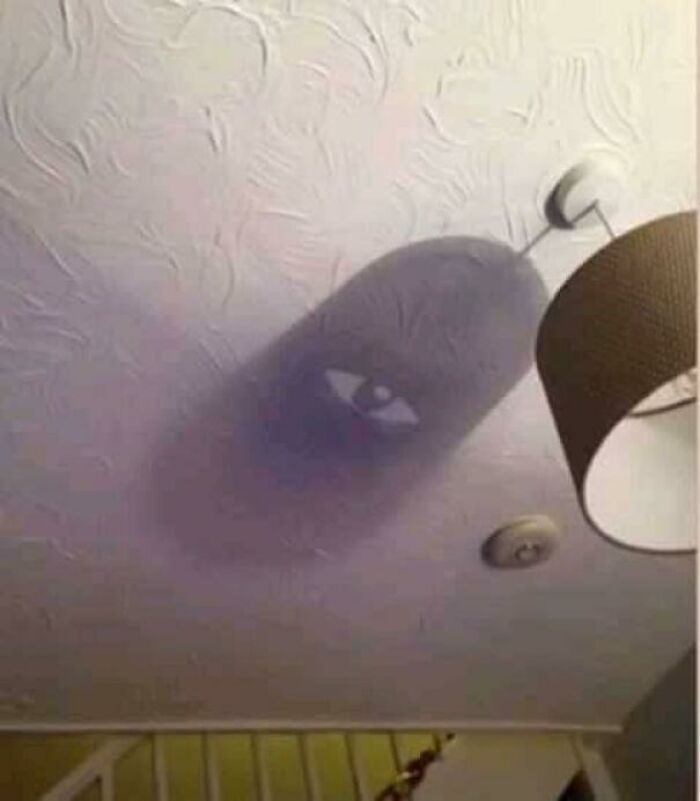
Where is `right wall`? right wall is located at coordinates (661, 759).